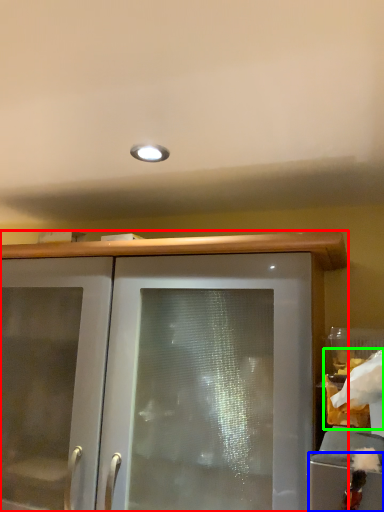
Question: Considering the real-world distances, which object is closest to cabinetry (highlighted by a red box)? cabinetry (highlighted by a blue box) or food (highlighted by a green box).

Choices:
 (A) cabinetry
 (B) food

Answer: (B)